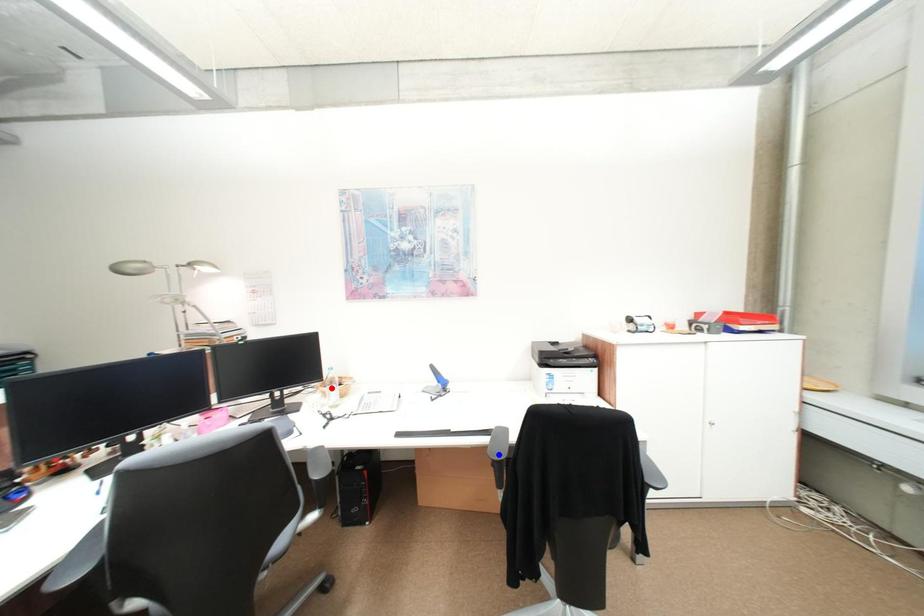
Question: Two points are marked on the image. Which point is closer to the camera?

Choices:
 (A) Blue point is closer.
 (B) Red point is closer.

Answer: (A)